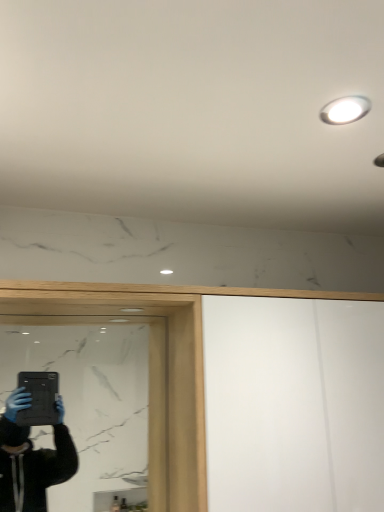
Where is `white glossy light fixture at upper right`? This screenshot has height=512, width=384. white glossy light fixture at upper right is located at coordinates (345, 110).

The image size is (384, 512). Describe the element at coordinates (345, 110) in the screenshot. I see `white glossy light fixture at upper right` at that location.

Describe the element at coordinates (91, 403) in the screenshot. I see `black glass mirror at lower left` at that location.

Where is `black glass mirror at lower left`? This screenshot has height=512, width=384. black glass mirror at lower left is located at coordinates (91, 403).

The image size is (384, 512). I want to click on white glossy light fixture at upper right, so click(x=345, y=110).

Based on the photo, can you confirm if white glossy light fixture at upper right is positioned to the left of black glass mirror at lower left?

Incorrect, white glossy light fixture at upper right is not on the left side of black glass mirror at lower left.

Considering the positions of objects white glossy light fixture at upper right and black glass mirror at lower left in the image provided, who is behind, white glossy light fixture at upper right or black glass mirror at lower left?

black glass mirror at lower left.

Which is in front, point (367, 108) or point (112, 376)?

The point (367, 108) is more forward.

From the image's perspective, does white glossy light fixture at upper right appear lower than black glass mirror at lower left?

No, from the image's perspective, white glossy light fixture at upper right is not beneath black glass mirror at lower left.

From a real-world perspective, which is physically below, white glossy light fixture at upper right or black glass mirror at lower left?

From a 3D spatial view, black glass mirror at lower left is below.

Is white glossy light fixture at upper right thinner than black glass mirror at lower left?

Incorrect, the width of white glossy light fixture at upper right is not less than that of black glass mirror at lower left.

Considering the sizes of white glossy light fixture at upper right and black glass mirror at lower left in the image, is white glossy light fixture at upper right taller or shorter than black glass mirror at lower left?

In the image, white glossy light fixture at upper right appears to be shorter than black glass mirror at lower left.

Considering the sizes of white glossy light fixture at upper right and black glass mirror at lower left in the image, is white glossy light fixture at upper right bigger or smaller than black glass mirror at lower left?

Considering their sizes, white glossy light fixture at upper right takes up less space than black glass mirror at lower left.

Is white glossy light fixture at upper right spatially inside black glass mirror at lower left, or outside of it?

white glossy light fixture at upper right is not enclosed by black glass mirror at lower left.

Are white glossy light fixture at upper right and black glass mirror at lower left far apart?

Yes.

Is white glossy light fixture at upper right positioned with its back to black glass mirror at lower left?

white glossy light fixture at upper right is not turned away from black glass mirror at lower left.

How many degrees apart are the facing directions of white glossy light fixture at upper right and black glass mirror at lower left?

1.07 degrees.

Where is `mirror on the left of white glossy light fixture at upper right`? mirror on the left of white glossy light fixture at upper right is located at coordinates (91, 403).

Considering the relative positions of black glass mirror at lower left and white glossy light fixture at upper right in the image provided, is black glass mirror at lower left to the left or to the right of white glossy light fixture at upper right?

In the image, black glass mirror at lower left appears on the left side of white glossy light fixture at upper right.

Which is behind, black glass mirror at lower left or white glossy light fixture at upper right?

black glass mirror at lower left is further away from the camera.

Is point (137, 360) closer or farther from the camera than point (348, 98)?

Point (137, 360) appears to be farther away from the viewer than point (348, 98).

From the image's perspective, which one is positioned higher, black glass mirror at lower left or white glossy light fixture at upper right?

white glossy light fixture at upper right, from the image's perspective.

From a real-world perspective, which object rests below the other?

black glass mirror at lower left.

Does black glass mirror at lower left have a lesser width compared to white glossy light fixture at upper right?

Indeed, black glass mirror at lower left has a lesser width compared to white glossy light fixture at upper right.

Looking at this image, which of these two, black glass mirror at lower left or white glossy light fixture at upper right, stands shorter?

white glossy light fixture at upper right is shorter.

Considering the relative sizes of black glass mirror at lower left and white glossy light fixture at upper right in the image provided, is black glass mirror at lower left smaller than white glossy light fixture at upper right?

No, black glass mirror at lower left is not smaller than white glossy light fixture at upper right.

Looking at this image, is black glass mirror at lower left not inside white glossy light fixture at upper right?

Yes, black glass mirror at lower left is outside of white glossy light fixture at upper right.

Is there a large distance between black glass mirror at lower left and white glossy light fixture at upper right?

Yes.

Is black glass mirror at lower left oriented towards white glossy light fixture at upper right?

No, black glass mirror at lower left does not turn towards white glossy light fixture at upper right.

What's the angular difference between black glass mirror at lower left and white glossy light fixture at upper right's facing directions?

black glass mirror at lower left and white glossy light fixture at upper right are facing 1.07 degrees away from each other.

Image resolution: width=384 pixels, height=512 pixels. I want to click on light fixture that appears on the right of black glass mirror at lower left, so click(345, 110).

Where is `light fixture on the right of black glass mirror at lower left`? This screenshot has height=512, width=384. light fixture on the right of black glass mirror at lower left is located at coordinates (345, 110).

At what (x,y) coordinates should I click in order to perform the action: click on mirror that appears behind the white glossy light fixture at upper right. Please return your answer as a coordinate pair (x, y). This screenshot has width=384, height=512. Looking at the image, I should click on (91, 403).